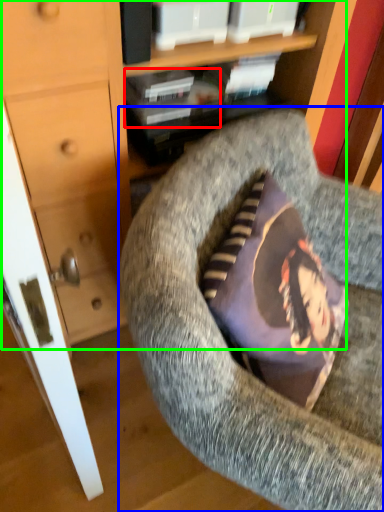
Question: Which object is the farthest from book (highlighted by a red box)? Choose among these: chair (highlighted by a blue box) or dresser (highlighted by a green box).

Choices:
 (A) chair
 (B) dresser

Answer: (A)